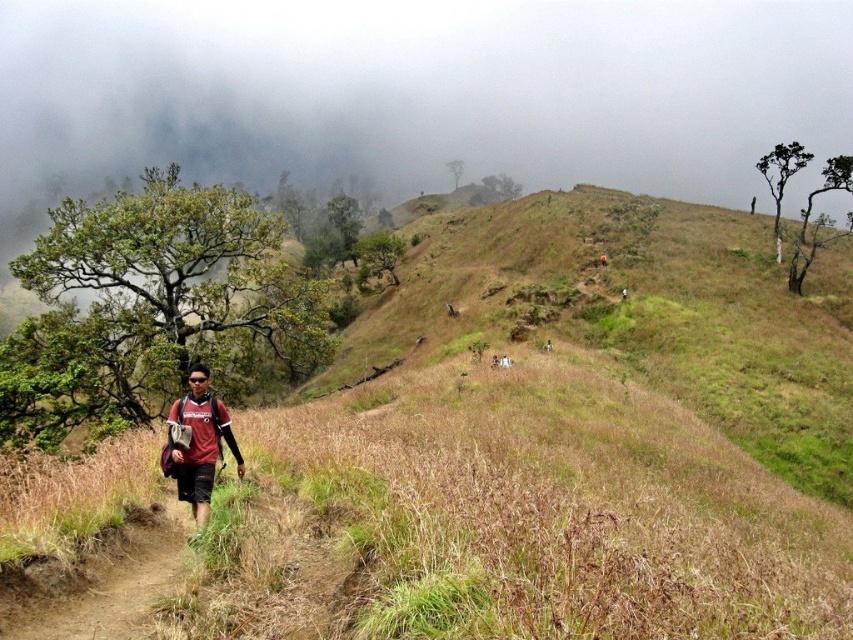
Question: Is dry grass at center to the left of matte red shirt at center from the viewer's perspective?

Choices:
 (A) yes
 (B) no

Answer: (B)

Question: Which point is farther from the camera taking this photo?

Choices:
 (A) (207, 458)
 (B) (479, 419)

Answer: (B)

Question: Does dry grass at center have a greater width compared to matte red shirt at center?

Choices:
 (A) yes
 (B) no

Answer: (A)

Question: Observing the image, what is the correct spatial positioning of dry grass at center in reference to matte red shirt at center?

Choices:
 (A) below
 (B) above

Answer: (B)

Question: Which object appears closest to the camera in this image?

Choices:
 (A) dry grass at center
 (B) matte red shirt at center

Answer: (A)

Question: Among these points, which one is nearest to the camera?

Choices:
 (A) (689, 465)
 (B) (196, 403)

Answer: (B)